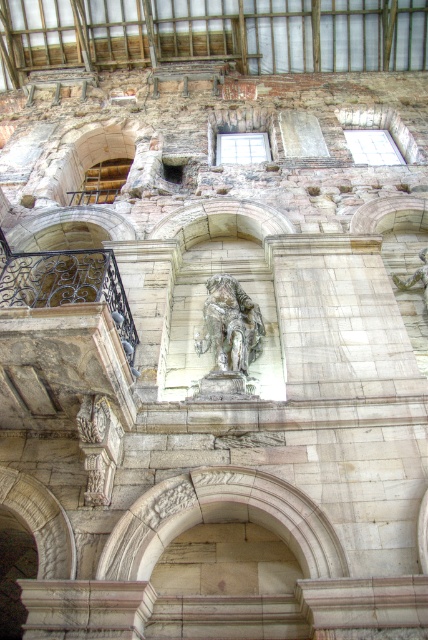
Which is in front, point (196, 509) or point (421, 266)?

Point (196, 509) is in front.

Does stone archway at center appear under green mossy stone statue at center?

Yes.

Who is more forward, (247, 484) or (395, 282)?

Point (247, 484)

Image resolution: width=428 pixels, height=640 pixels. I want to click on stone archway at center, so click(x=219, y=518).

Which is in front, point (231, 502) or point (232, 371)?

Point (231, 502)

Can you confirm if stone archway at center is taller than bronze statue at center?

In fact, stone archway at center may be shorter than bronze statue at center.

Locate an element on the screen. The width and height of the screenshot is (428, 640). stone archway at center is located at coordinates (219, 518).

Does bronze statue at center have a greater width compared to green mossy stone statue at center?

Correct, the width of bronze statue at center exceeds that of green mossy stone statue at center.

Can you confirm if bronze statue at center is taller than green mossy stone statue at center?

Yes.

Which is in front, point (228, 346) or point (425, 268)?

Point (228, 346)

Locate an element on the screen. The width and height of the screenshot is (428, 640). bronze statue at center is located at coordinates (229, 324).